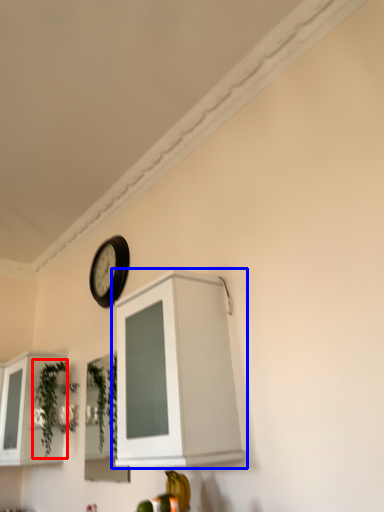
Question: Which object is closer to the camera taking this photo, plant (highlighted by a red box) or cabinetry (highlighted by a blue box)?

Choices:
 (A) plant
 (B) cabinetry

Answer: (B)